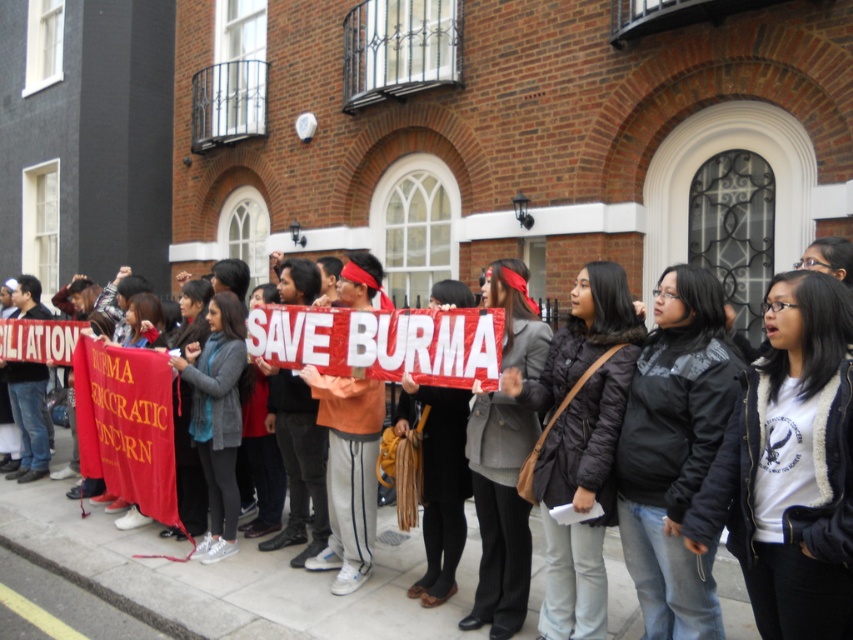
Question: Based on their relative distances, which object is farther from the matte black coat at center?

Choices:
 (A) matte red banner at center
 (B) gray fabric jacket at center
 (C) matte gray blazer at center

Answer: (A)

Question: Where is red fabric banner at center located in relation to matte gray sweater at center in the image?

Choices:
 (A) right
 (B) left

Answer: (B)

Question: Which of the following is the closest to the observer?

Choices:
 (A) (160, 317)
 (B) (200, 484)

Answer: (B)

Question: Does black textured jacket at lower right have a larger size compared to gray fabric jacket at center?

Choices:
 (A) no
 (B) yes

Answer: (B)

Question: Does white fleece jacket at center have a larger size compared to gray fabric jacket at center?

Choices:
 (A) no
 (B) yes

Answer: (B)

Question: Which object is positioned closest to the red fabric banner at center?

Choices:
 (A) matte red banner at center
 (B) dark brown puffer jacket at center
 (C) matte black coat at center

Answer: (C)